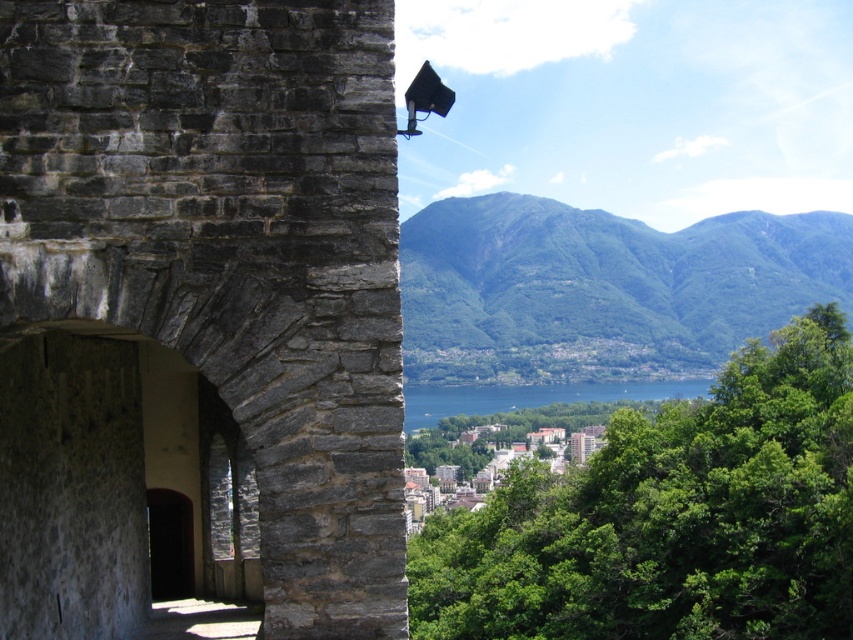
You are an architect evaluating the structural integrity of the gray stone arch at center and the blue water at center in the image. Which of these two elements has a narrower span?

The gray stone arch at center has a lesser width compared to the blue water at center, so the gray stone arch at center has a narrower span.

You are standing in front of a historical stone structure. You see a gray stone arch at center and a blue water at center. Which object is positioned to the left of the other?

The gray stone arch at center is positioned to the left of blue water at center.